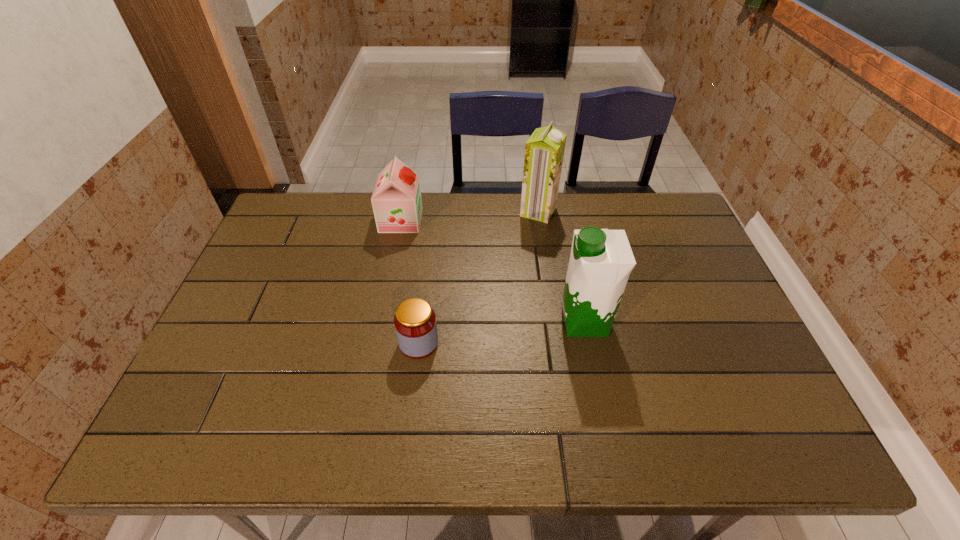
Identify the location of the nearest soya milk. This screenshot has height=540, width=960. (601, 260).

At what (x,y) coordinates should I click in order to perform the action: click on the leftmost soya milk. Please return your answer as a coordinate pair (x, y). The height and width of the screenshot is (540, 960). Looking at the image, I should click on (396, 200).

I want to click on the shortest soya milk, so click(396, 200).

Identify the location of jar. The image size is (960, 540). (415, 324).

The image size is (960, 540). I want to click on vacant space located on the front-facing side of the nearest soya milk, so click(490, 322).

At what (x,y) coordinates should I click in order to perform the action: click on free region located 0.300m on the front-facing side of the nearest soya milk. Please return your answer as a coordinate pair (x, y). This screenshot has width=960, height=540. Looking at the image, I should click on (444, 322).

At what (x,y) coordinates should I click in order to perform the action: click on vacant space located on the front-facing side of the nearest soya milk. Please return your answer as a coordinate pair (x, y). The width and height of the screenshot is (960, 540). Looking at the image, I should click on (536, 322).

The image size is (960, 540). In order to click on vacant area situated with the cap open on the leftmost soya milk in this screenshot , I will do `click(522, 220)`.

Locate an element on the screen. The image size is (960, 540). free space located 0.310m on the back of the shortest object is located at coordinates (430, 247).

Find the location of a particular element. This screenshot has width=960, height=540. vacant space at the far edge is located at coordinates (544, 234).